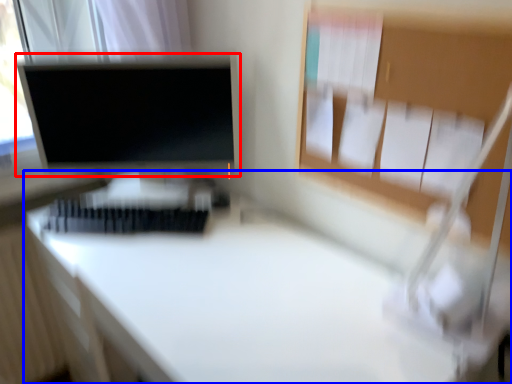
Question: Which of the following is the closest to the observer, computer monitor (highlighted by a red box) or desk (highlighted by a blue box)?

Choices:
 (A) computer monitor
 (B) desk

Answer: (B)